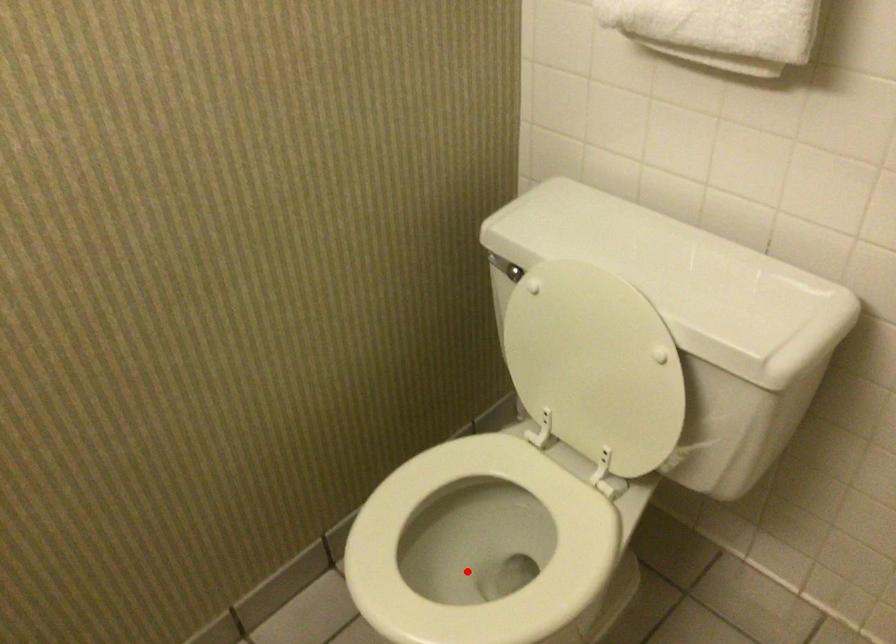
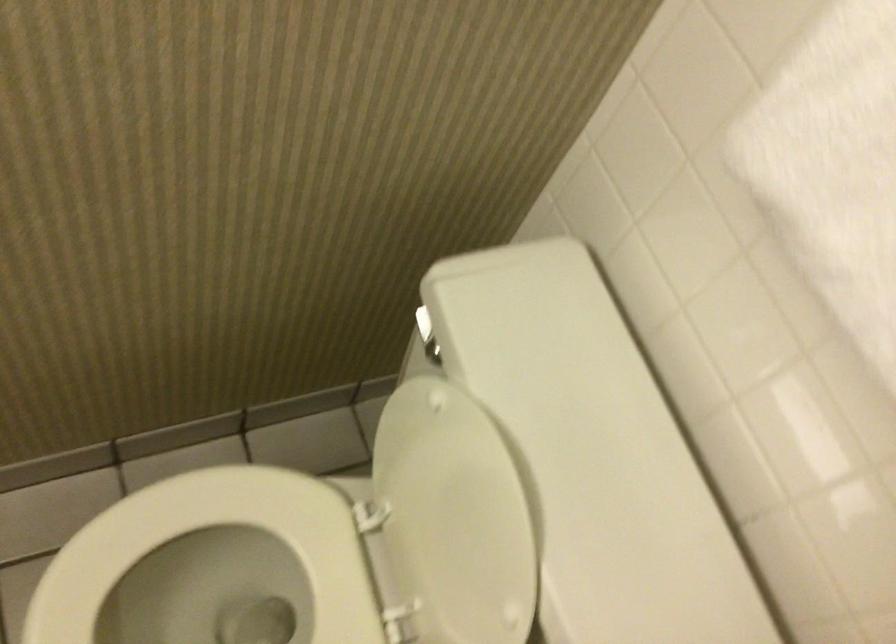
Find the pixel in the second image that matches the highlighted location in the first image.

(222, 590)